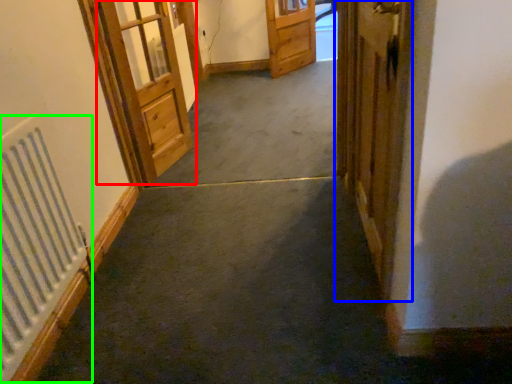
Question: Which object is positioned farthest from door (highlighted by a red box)? Select from door (highlighted by a blue box) and radiator (highlighted by a green box).

Choices:
 (A) door
 (B) radiator

Answer: (A)